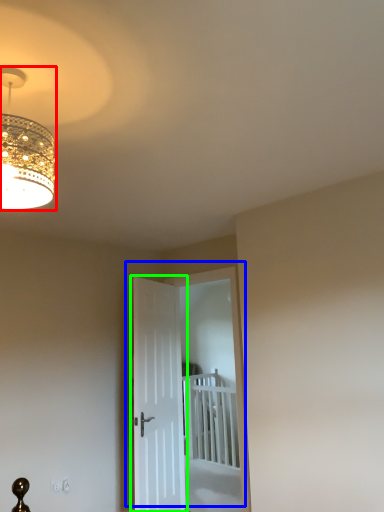
Question: Considering the real-world distances, which object is farthest from lamp (highlighted by a red box)? door (highlighted by a blue box) or door (highlighted by a green box)?

Choices:
 (A) door
 (B) door

Answer: (A)